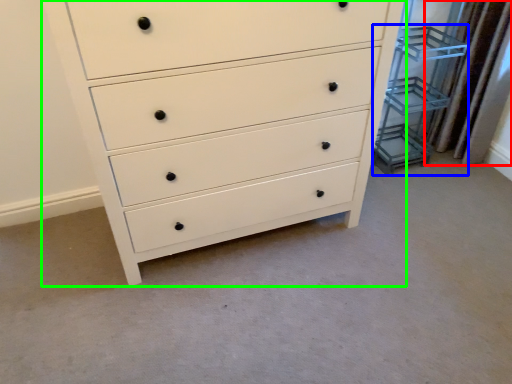
Question: Estimate the real-world distances between objects in this image. Which object is farther from curtain (highlighted by a red box), cabinet (highlighted by a blue box) or chest of drawers (highlighted by a green box)?

Choices:
 (A) cabinet
 (B) chest of drawers

Answer: (B)